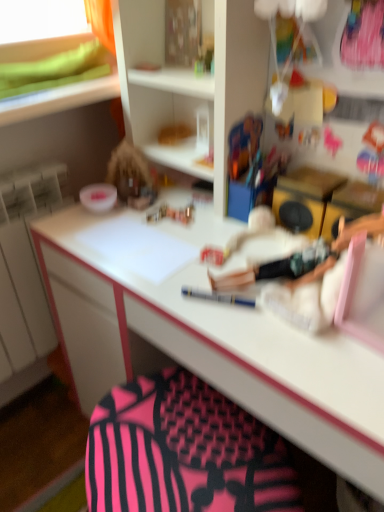
Locate an element on the screen. The width and height of the screenshot is (384, 512). free point above pink fabric swivel chair at lower center (from a real-world perspective) is located at coordinates (168, 431).